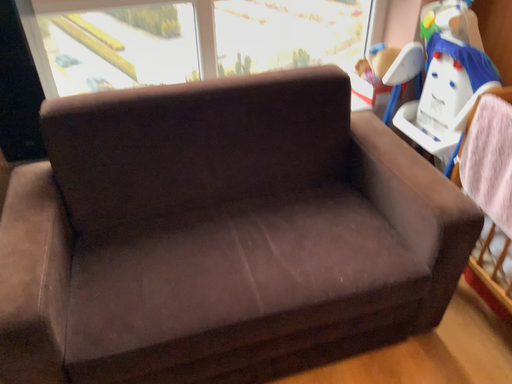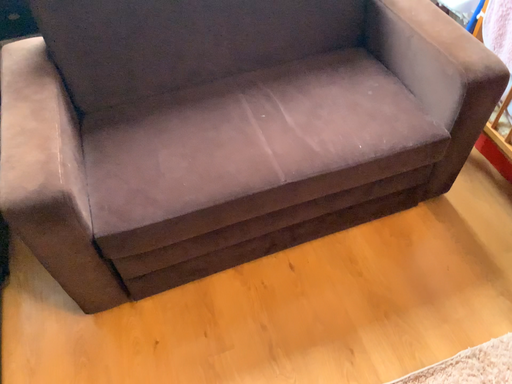
Question: Which way did the camera rotate in the video?

Choices:
 (A) rotated downward
 (B) rotated upward

Answer: (A)